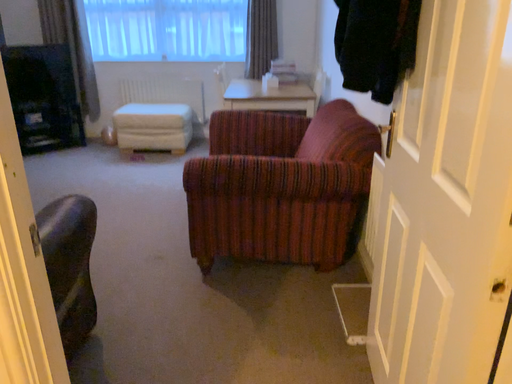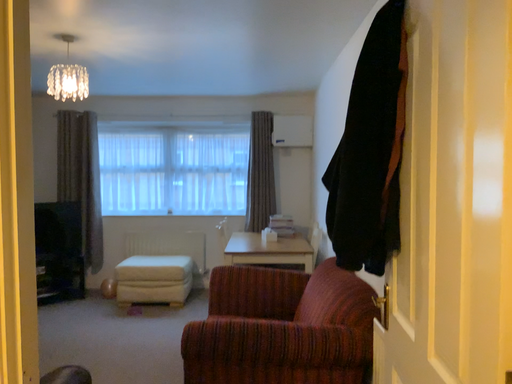
Question: How did the camera likely rotate when shooting the video?

Choices:
 (A) rotated upward
 (B) rotated downward

Answer: (A)